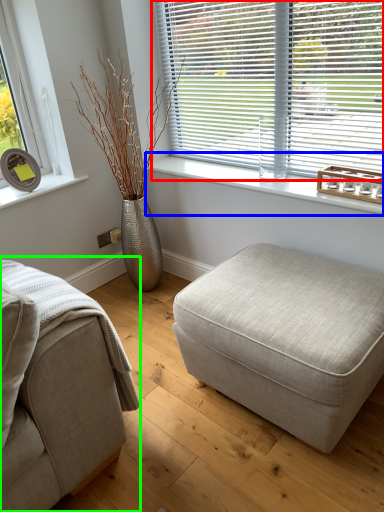
Question: Which is farther away from window blind (highlighted by a red box)? window sill (highlighted by a blue box) or studio couch (highlighted by a green box)?

Choices:
 (A) window sill
 (B) studio couch

Answer: (B)